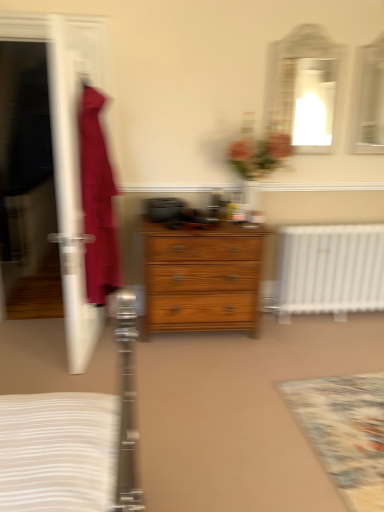
Locate an element on the screen. free region under matte white mirror at upper right, which appears as the 2th mirror when viewed from the right (from a real-world perspective) is located at coordinates (303, 179).